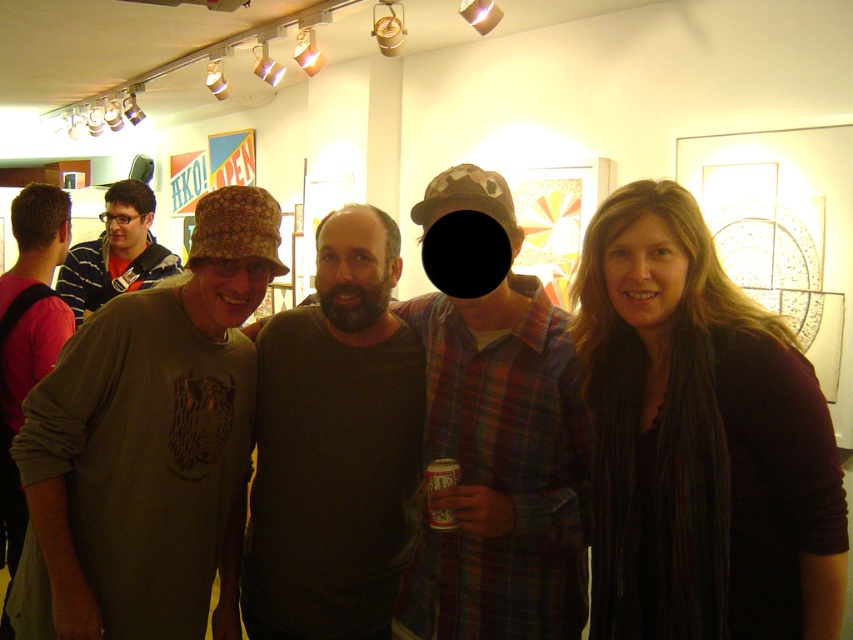
Question: Which point appears farthest from the camera in this image?

Choices:
 (A) (273, 618)
 (B) (131, 205)
 (C) (61, 413)
 (D) (422, 321)

Answer: (B)

Question: Is matte green t-shirt at center closer to camera compared to metallic silver can at center?

Choices:
 (A) yes
 (B) no

Answer: (A)

Question: Which point appears farthest from the camera in this image?

Choices:
 (A) (94, 404)
 (B) (448, 515)

Answer: (A)

Question: Which of the following is the farthest from the observer?

Choices:
 (A) (223, 262)
 (B) (167, 252)
 (C) (503, 502)
 (D) (312, 326)

Answer: (B)

Question: In this image, where is camouflage-patterned hat at left located relative to metallic silver can at center?

Choices:
 (A) left
 (B) right

Answer: (A)

Question: Considering the relative positions of matte green t-shirt at center and metallic silver can at center in the image provided, where is matte green t-shirt at center located with respect to metallic silver can at center?

Choices:
 (A) left
 (B) right

Answer: (A)